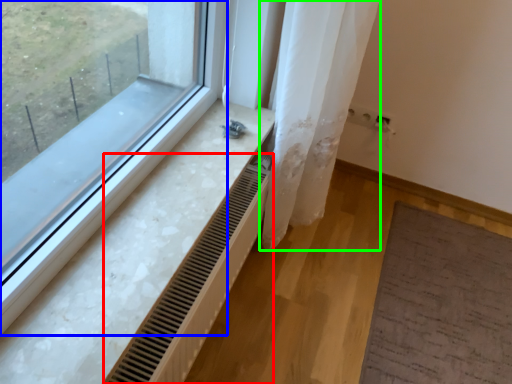
Question: Considering the real-world distances, which object is farthest from radiator (highlighted by a red box)? window (highlighted by a blue box) or shower curtain (highlighted by a green box)?

Choices:
 (A) window
 (B) shower curtain

Answer: (B)